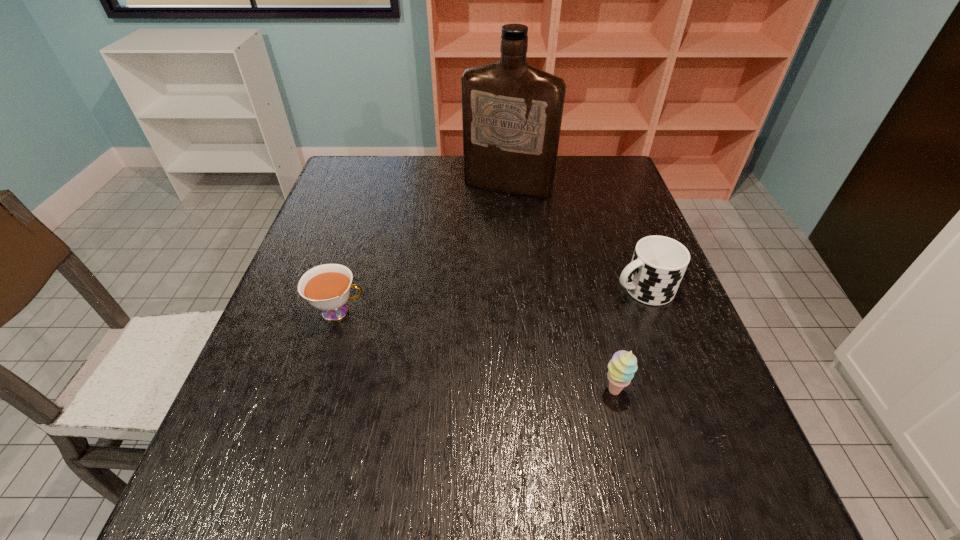
Where is `vacant spot on the desktop that is between the leftmost object and the sherbert and is positioned on the side of the rightmost object with the handle`? vacant spot on the desktop that is between the leftmost object and the sherbert and is positioned on the side of the rightmost object with the handle is located at coordinates (468, 348).

Locate an element on the screen. The height and width of the screenshot is (540, 960). free space on the desktop that is between the shortest object and the third object from left to right and is positioned on the label side of the liquor is located at coordinates (432, 338).